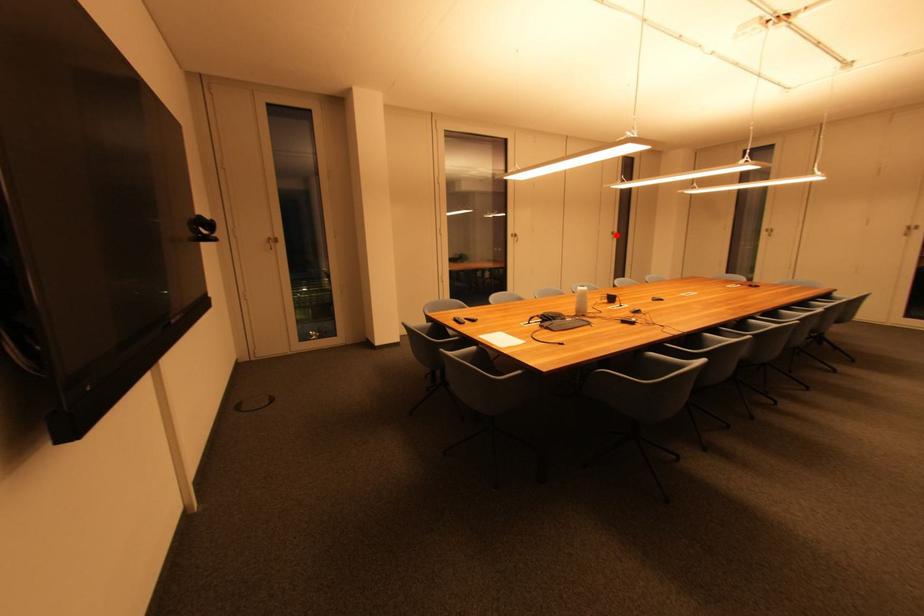
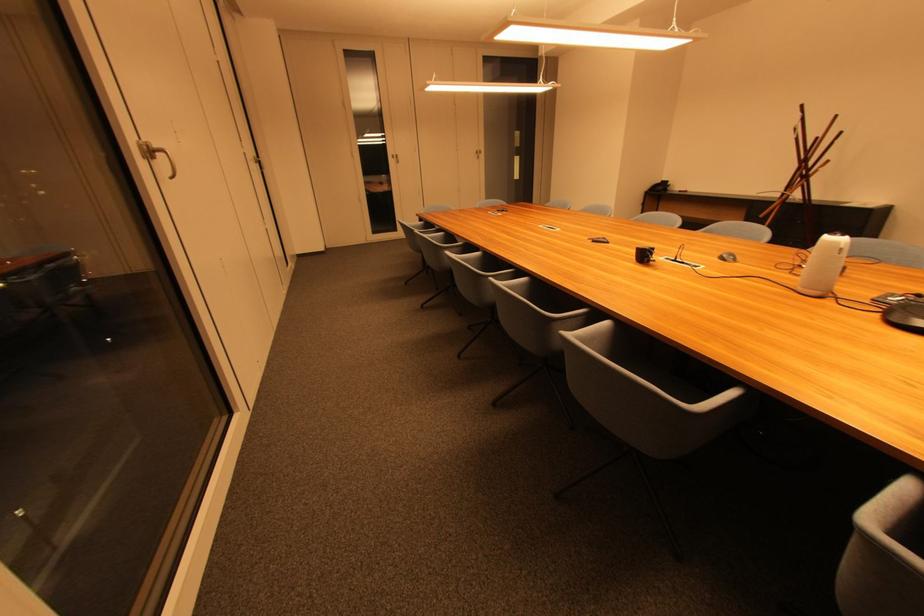
Question: I am providing you with two images of the same scene from different viewpoints. In image1, a red point is highlighted. Considering the same 3D point in image2, which of the following is correct?

Choices:
 (A) It is closer
 (B) It is farther

Answer: (B)